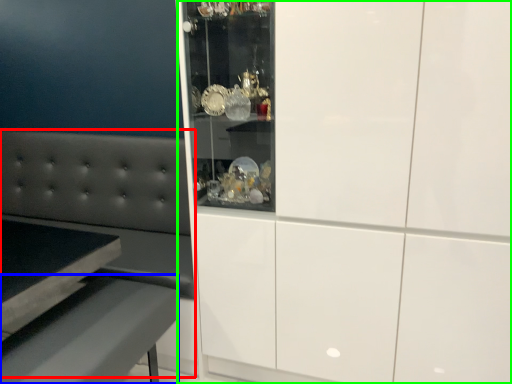
Question: Based on their relative distances, which object is nearer to couch (highlighted by a red box)? Choose from table (highlighted by a blue box) and cabinetry (highlighted by a green box).

Choices:
 (A) table
 (B) cabinetry

Answer: (A)